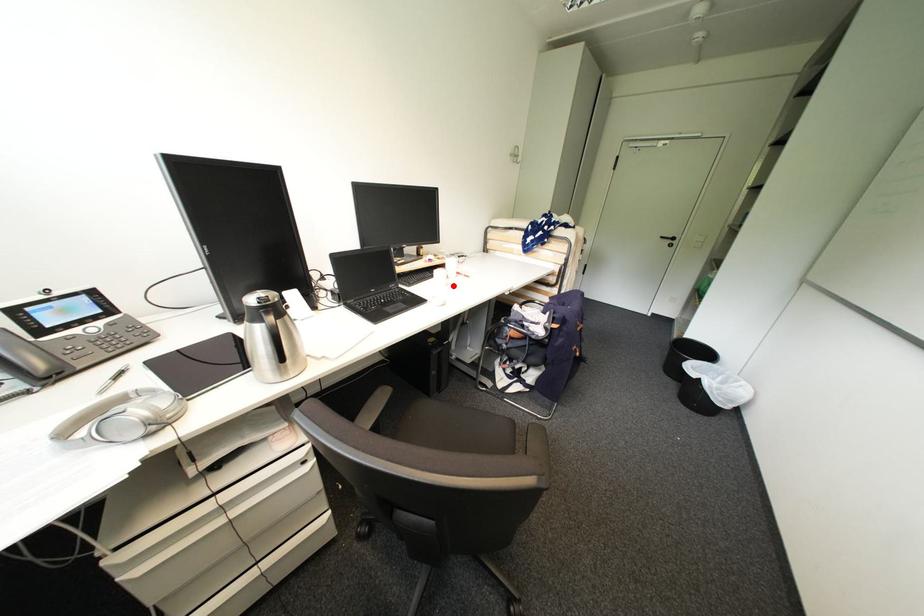
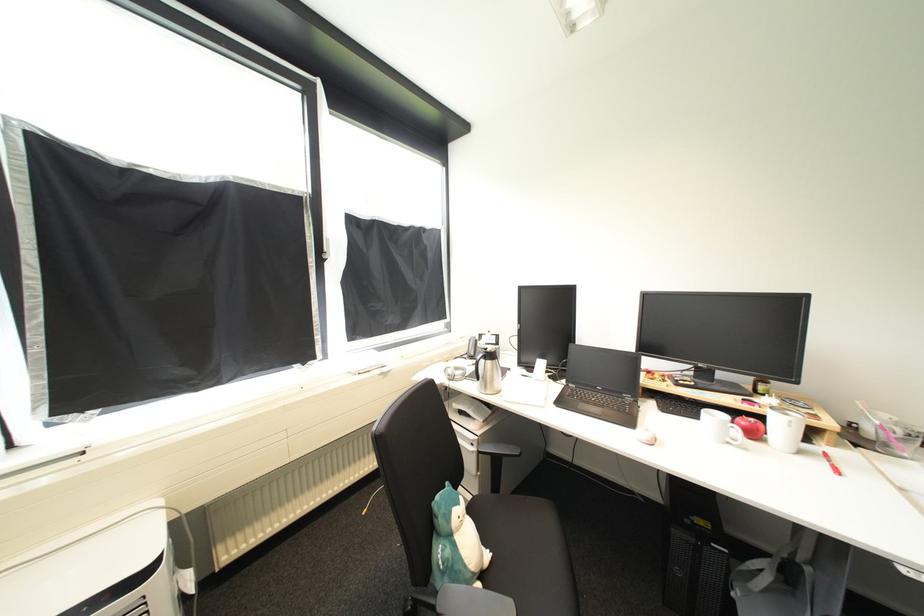
Locate, in the second image, the point that corresponds to the highlighted location in the first image.

(736, 445)